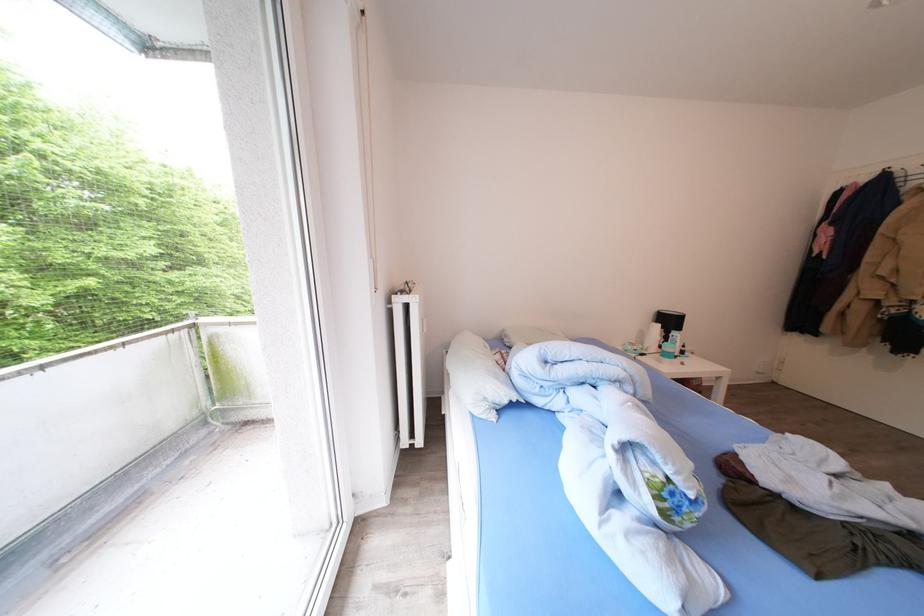
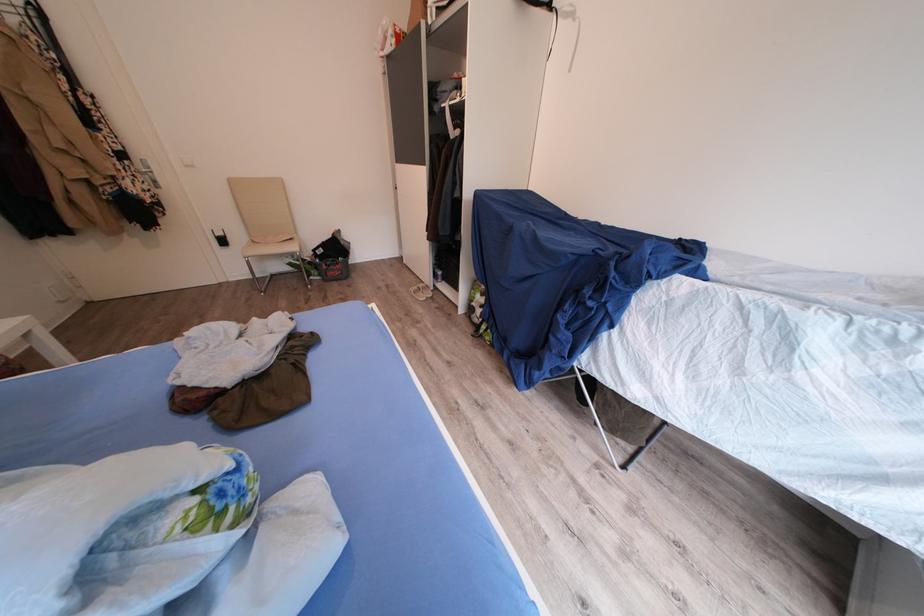
Locate, in the second image, the point that corresponds to [673,490] in the first image.

(213, 507)